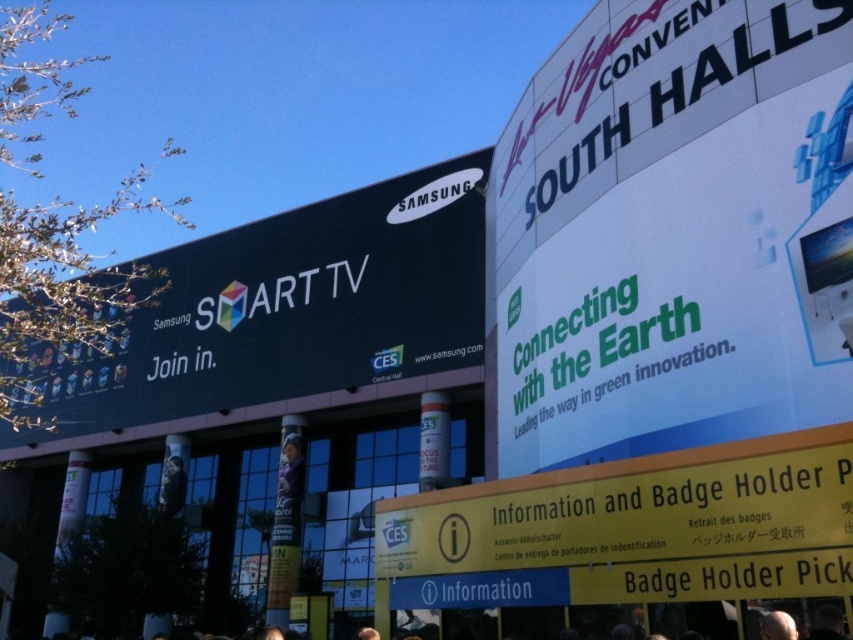
Question: From the image, what is the correct spatial relationship of black matte sign at upper left in relation to dark hair at lower right?

Choices:
 (A) right
 (B) left

Answer: (B)

Question: Is dark gray hair at lower center below dark hair at lower right?

Choices:
 (A) no
 (B) yes

Answer: (B)

Question: Which point is farther from the camera taking this photo?

Choices:
 (A) (786, 618)
 (B) (804, 609)

Answer: (B)

Question: Which object is positioned closest to the black matte sign at upper left?

Choices:
 (A) dark hair at lower right
 (B) bald head at lower right
 (C) dark gray hair at lower center

Answer: (C)

Question: Can you confirm if dark hair at lower right is positioned below bald head at lower right?

Choices:
 (A) yes
 (B) no

Answer: (B)

Question: Which point is farther from the camera taking this photo?

Choices:
 (A) (773, 611)
 (B) (247, 330)

Answer: (B)